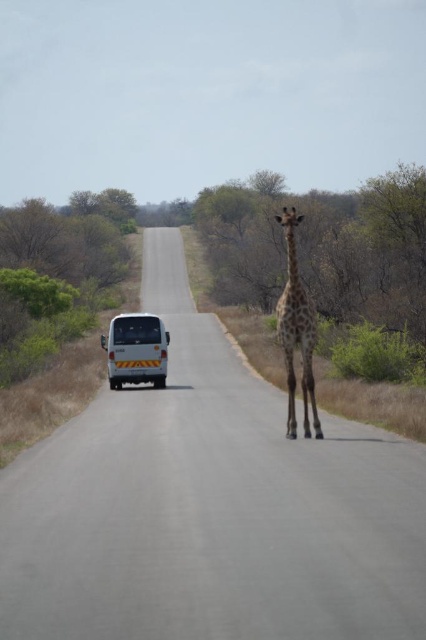
Question: Does spotted fur giraffe at center have a lesser width compared to white matte van at center?

Choices:
 (A) yes
 (B) no

Answer: (B)

Question: Which point appears farthest from the camera in this image?

Choices:
 (A) (x=132, y=326)
 (B) (x=285, y=428)

Answer: (A)

Question: Does spotted fur giraffe at center have a greater width compared to white matte van at center?

Choices:
 (A) yes
 (B) no

Answer: (A)

Question: Can you confirm if spotted fur giraffe at center is thinner than white matte van at center?

Choices:
 (A) no
 (B) yes

Answer: (A)